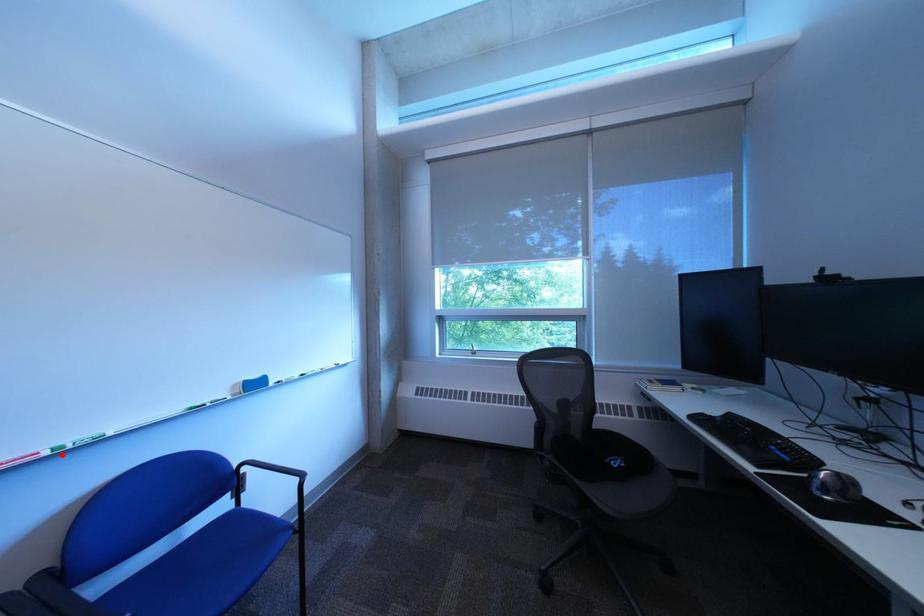
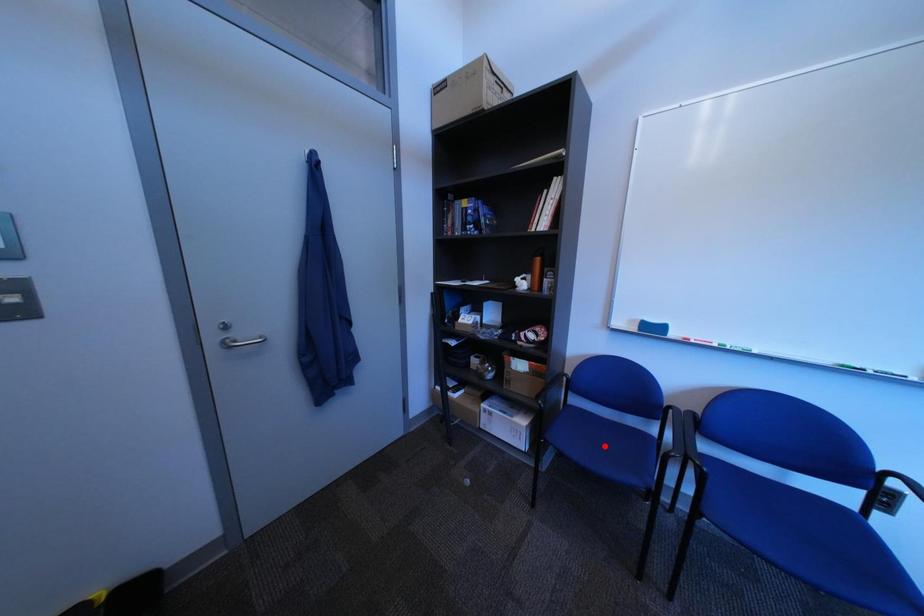
I am providing you with two images of the same scene from different viewpoints. A red point is marked on the first image and another point is marked on the second image. Does the point marked in image1 correspond to the same location as the one in image2?

No